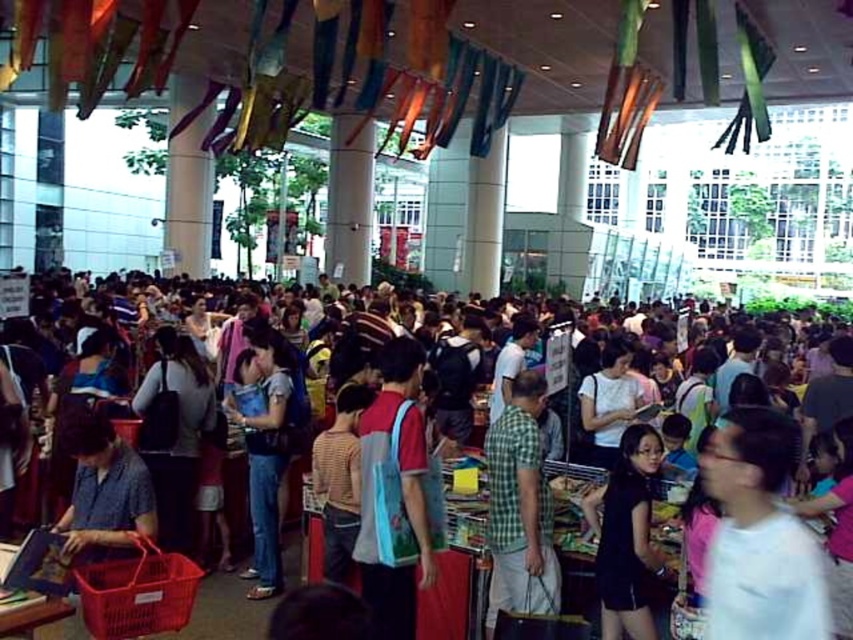
Question: From the image, what is the correct spatial relationship of matte plastic bags at center in relation to blue fabric bag at center?

Choices:
 (A) left
 (B) right

Answer: (A)

Question: Considering the relative positions of matte plastic bags at center and denim jeans at center in the image provided, where is matte plastic bags at center located with respect to denim jeans at center?

Choices:
 (A) right
 (B) left

Answer: (A)

Question: Which point is farther to the camera?

Choices:
 (A) [624, 618]
 (B) [74, 497]
 (C) [260, 422]

Answer: (C)

Question: Based on their relative distances, which object is nearer to the blue fabric bag at center?

Choices:
 (A) black matte dress at lower right
 (B) green plaid shirt at center
 (C) denim jeans at center

Answer: (B)

Question: Is blue fabric bag at center smaller than green plaid shirt at center?

Choices:
 (A) no
 (B) yes

Answer: (A)

Question: Which object is positioned closest to the black matte dress at lower right?

Choices:
 (A) matte plastic bags at center
 (B) denim jeans at center
 (C) green plaid shirt at center

Answer: (C)